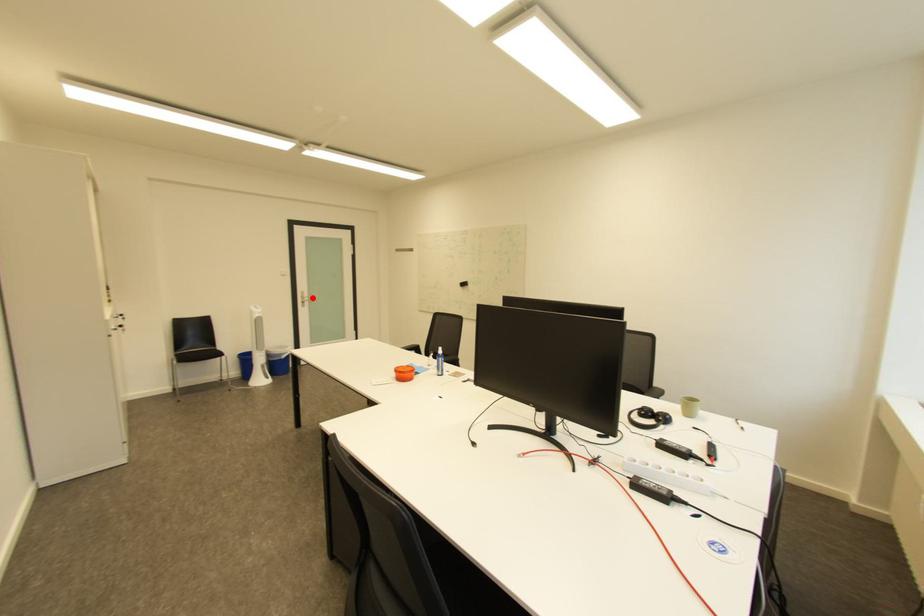
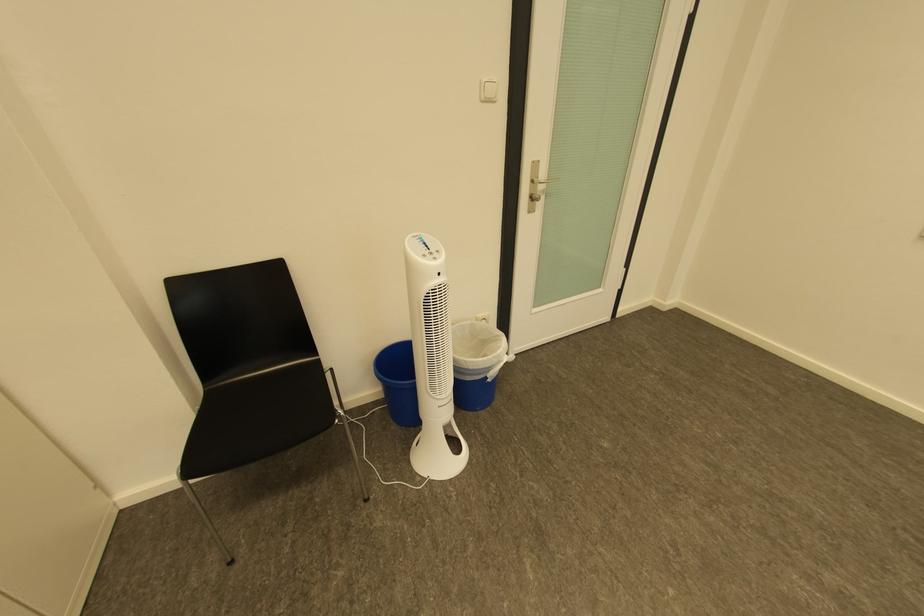
Question: I am providing you with two images of the same scene from different viewpoints. Image1 has a red point marked. In image2, the corresponding 3D location appears at what relative position? Reply with the corresponding letter.

Choices:
 (A) Closer
 (B) Farther

Answer: (A)